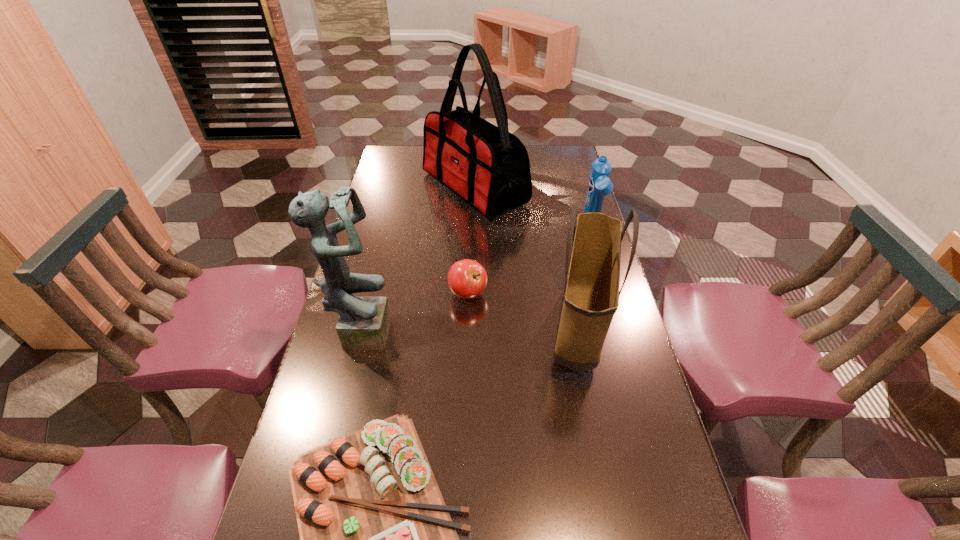
Locate an element on the screen. object located in the far edge section of the desktop is located at coordinates (487, 166).

Locate an element on the screen. This screenshot has height=540, width=960. object that is at the left edge is located at coordinates (364, 322).

Where is `tote bag present at the right edge`? The height and width of the screenshot is (540, 960). tote bag present at the right edge is located at coordinates (591, 294).

What are the coordinates of `shampoo that is at the right edge` in the screenshot? It's located at (599, 185).

In the image, there is a desktop. Identify the location of vacant space at the left edge. (384, 177).

This screenshot has height=540, width=960. I want to click on vacant region at the right edge, so click(x=618, y=477).

Locate an element on the screen. The image size is (960, 540). vacant space at the far left corner of the desktop is located at coordinates (397, 153).

At what (x,y) coordinates should I click in order to perform the action: click on vacant space at the far right corner of the desktop. Please return your answer as a coordinate pair (x, y). The width and height of the screenshot is (960, 540). Looking at the image, I should click on (570, 146).

Locate an element on the screen. This screenshot has width=960, height=540. vacant space that is in between the apple and the duffel bag is located at coordinates (471, 241).

Identify the location of free space between the tote bag and the second shortest object. The image size is (960, 540). (523, 312).